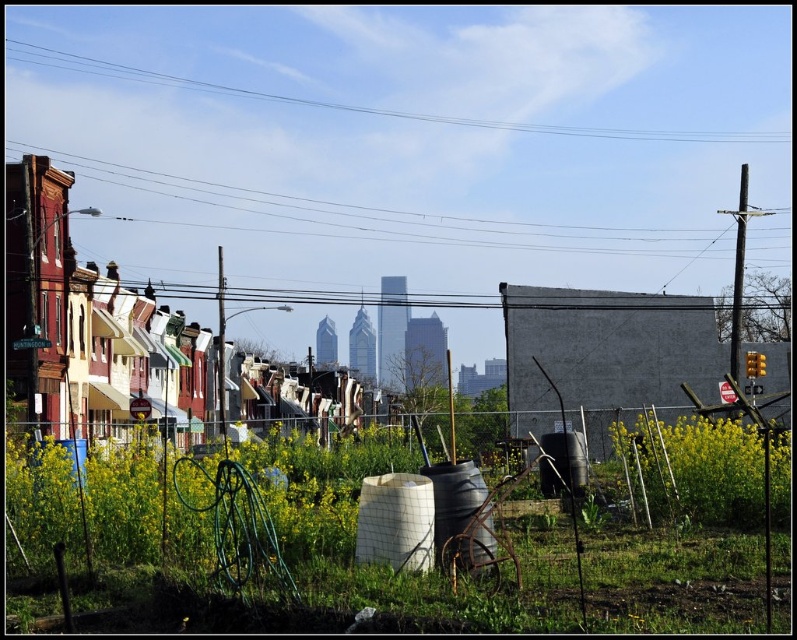
You are a maintenance worker checking the height of the green grass at lower center and the clear blue wire at upper center. Which one is taller?

The clear blue wire at upper center is taller than the green grass at lower center.

You are standing at point (275, 538) in the urban scene. What do you see directly under your feet?

At point (275, 538) lies green grass at lower center.